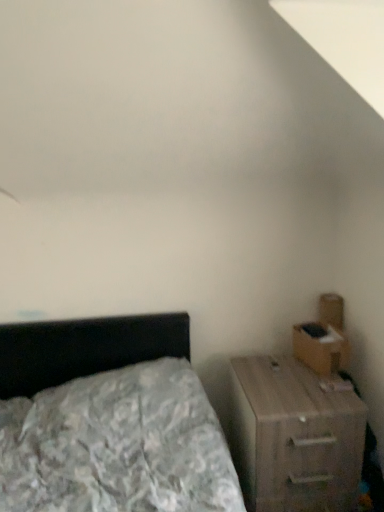
Question: Is brown cardboard drawer at right to the left or to the right of wooden nightstand at right in the image?

Choices:
 (A) left
 (B) right

Answer: (B)

Question: Is brown cardboard drawer at right in front of or behind wooden nightstand at right in the image?

Choices:
 (A) behind
 (B) front

Answer: (A)

Question: From their relative heights in the image, would you say brown cardboard drawer at right is taller or shorter than wooden nightstand at right?

Choices:
 (A) tall
 (B) short

Answer: (B)

Question: Is point (251, 485) closer or farther from the camera than point (339, 366)?

Choices:
 (A) closer
 (B) farther

Answer: (A)

Question: Is wooden nightstand at right wider or thinner than brown cardboard drawer at right?

Choices:
 (A) wide
 (B) thin

Answer: (A)

Question: Is wooden nightstand at right in front of or behind brown cardboard drawer at right in the image?

Choices:
 (A) front
 (B) behind

Answer: (A)

Question: From a real-world perspective, relative to brown cardboard drawer at right, is wooden nightstand at right vertically above or below?

Choices:
 (A) below
 (B) above

Answer: (A)